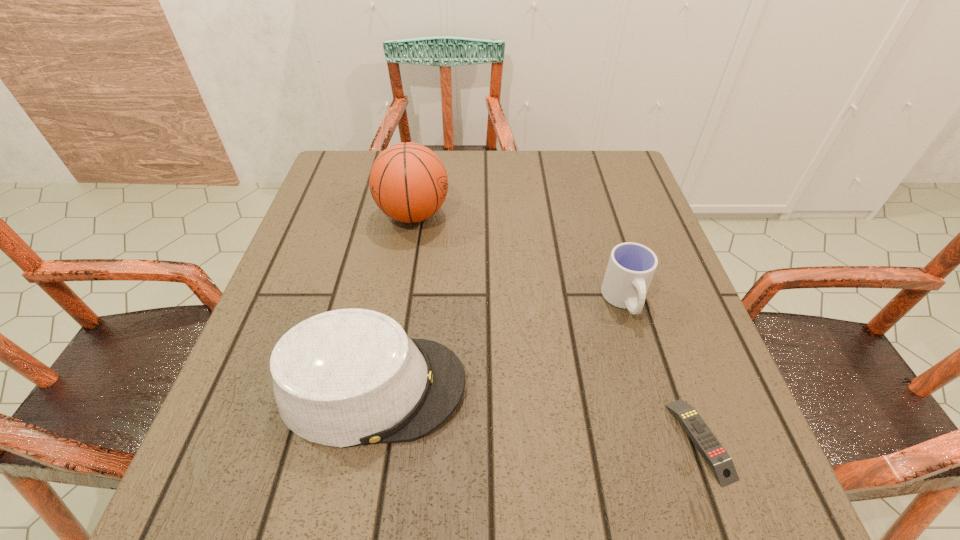
Locate an element on the screen. This screenshot has width=960, height=540. vacant space that satisfies the following two spatial constraints: 1. with the handle on the side of the shortest object; 2. on the right side of the cup is located at coordinates 666,440.